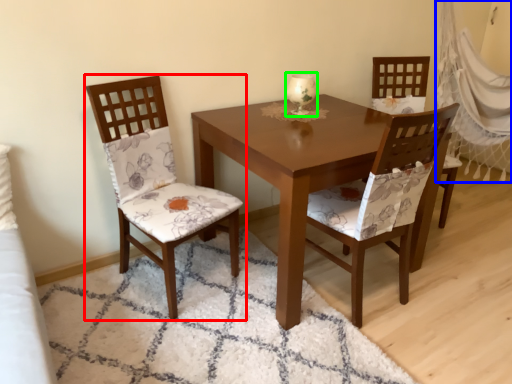
Question: Which is farther away from chair (highlighted by a red box)? curtain (highlighted by a blue box) or candle holder (highlighted by a green box)?

Choices:
 (A) curtain
 (B) candle holder

Answer: (A)